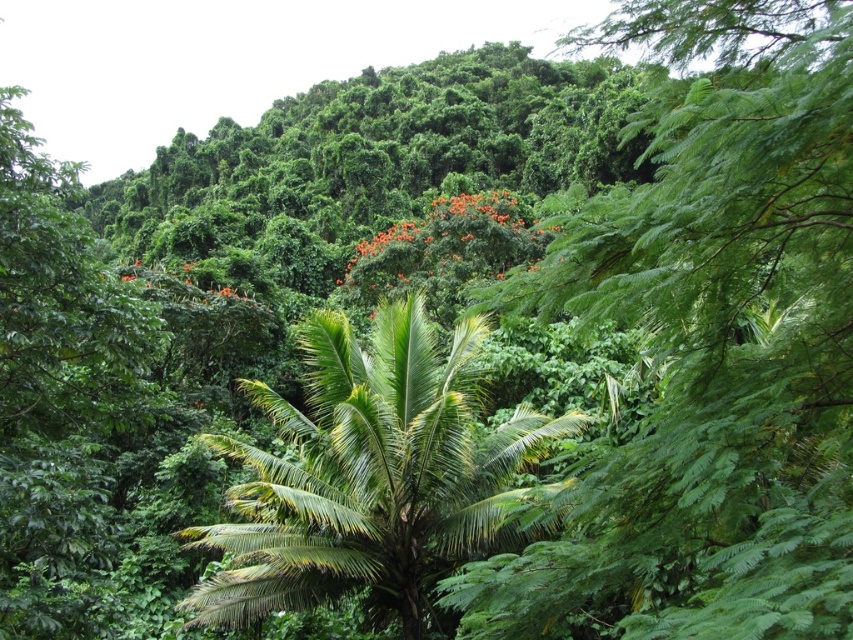
Is point (434, 465) closer to camera compared to point (405, 253)?

That is True.

The image size is (853, 640). What do you see at coordinates (364, 474) in the screenshot?
I see `green leafy palm at center` at bounding box center [364, 474].

Image resolution: width=853 pixels, height=640 pixels. Find the location of `green leafy palm at center`. green leafy palm at center is located at coordinates (364, 474).